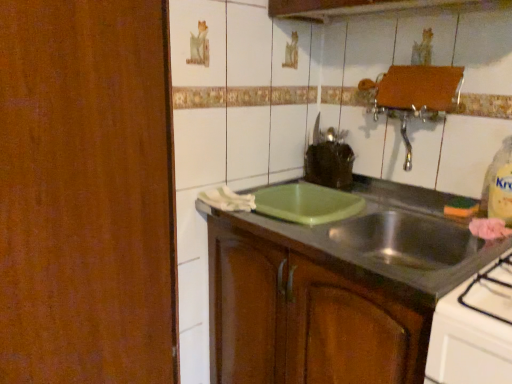
Question: Does green plastic cutting board at center have a lesser width compared to green matte cutting board at center?

Choices:
 (A) yes
 (B) no

Answer: (B)

Question: Does green plastic cutting board at center have a smaller size compared to green matte cutting board at center?

Choices:
 (A) yes
 (B) no

Answer: (A)

Question: From the image's perspective, is green plastic cutting board at center over green matte cutting board at center?

Choices:
 (A) yes
 (B) no

Answer: (A)

Question: Considering the relative sizes of green plastic cutting board at center and green matte cutting board at center in the image provided, is green plastic cutting board at center wider than green matte cutting board at center?

Choices:
 (A) yes
 (B) no

Answer: (A)

Question: Does green plastic cutting board at center contain green matte cutting board at center?

Choices:
 (A) no
 (B) yes

Answer: (A)

Question: Is green plastic cutting board at center closer to camera compared to green matte cutting board at center?

Choices:
 (A) no
 (B) yes

Answer: (B)

Question: Is the depth of green matte cutting board at center less than that of green plastic cutting board at center?

Choices:
 (A) no
 (B) yes

Answer: (A)

Question: Does green matte cutting board at center have a greater width compared to green plastic cutting board at center?

Choices:
 (A) no
 (B) yes

Answer: (A)

Question: From the image's perspective, is green matte cutting board at center located above green plastic cutting board at center?

Choices:
 (A) no
 (B) yes

Answer: (A)

Question: Can we say green matte cutting board at center lies outside green plastic cutting board at center?

Choices:
 (A) no
 (B) yes

Answer: (B)

Question: From a real-world perspective, is green matte cutting board at center positioned under green plastic cutting board at center based on gravity?

Choices:
 (A) yes
 (B) no

Answer: (A)

Question: Does green matte cutting board at center come behind green plastic cutting board at center?

Choices:
 (A) yes
 (B) no

Answer: (A)

Question: In terms of size, does green matte cutting board at center appear bigger or smaller than green plastic cutting board at center?

Choices:
 (A) big
 (B) small

Answer: (A)